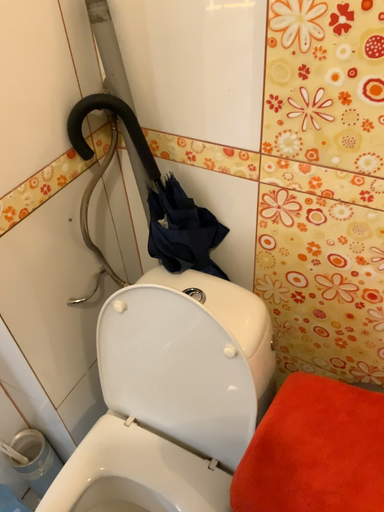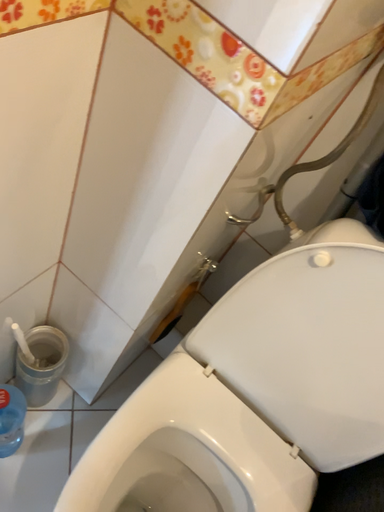
Question: Which way did the camera rotate in the video?

Choices:
 (A) rotated downward
 (B) rotated upward

Answer: (A)